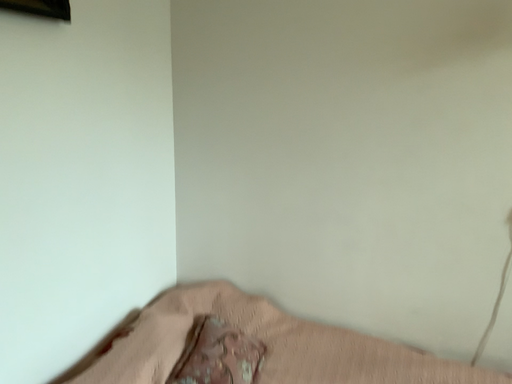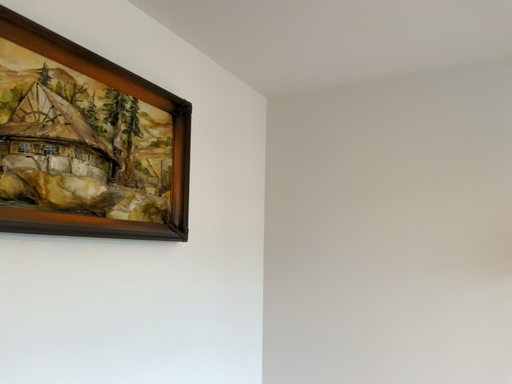
Question: Which way did the camera rotate in the video?

Choices:
 (A) rotated left
 (B) rotated right

Answer: (A)